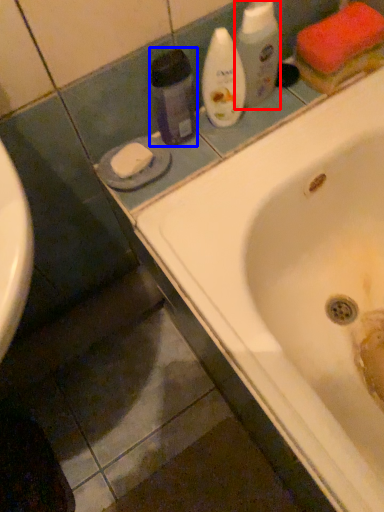
Question: Which object appears closest to the camera in this image, cleaning product (highlighted by a red box) or cleaning product (highlighted by a blue box)?

Choices:
 (A) cleaning product
 (B) cleaning product

Answer: (B)